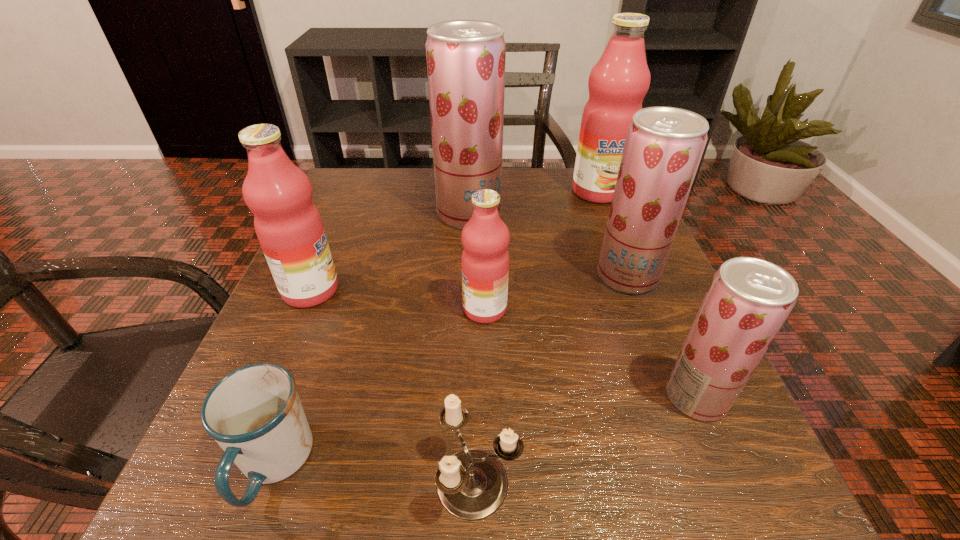
At what (x,y) coordinates should I click in order to perform the action: click on candle holder. Please return your answer as a coordinate pair (x, y). This screenshot has width=960, height=540. Looking at the image, I should click on (472, 484).

Locate an element on the screen. The height and width of the screenshot is (540, 960). mug is located at coordinates (254, 413).

Locate an element on the screen. This screenshot has width=960, height=540. free location located 0.110m on the right of the leftmost strawberry fruit juice is located at coordinates (550, 213).

At what (x,y) coordinates should I click in order to perform the action: click on free space located 0.250m on the label of the biggest pink fruit juice. Please return your answer as a coordinate pair (x, y). Looking at the image, I should click on (632, 276).

Find the location of a particular element. This screenshot has width=960, height=540. free space located on the front of the second biggest strawberry fruit juice is located at coordinates (695, 451).

Locate an element on the screen. vacant point located 0.310m on the label of the leftmost pink fruit juice is located at coordinates (510, 291).

Where is `vacant space located on the label of the second pink fruit juice from left to right`? The height and width of the screenshot is (540, 960). vacant space located on the label of the second pink fruit juice from left to right is located at coordinates (411, 309).

You are a GUI agent. You are given a task and a screenshot of the screen. Output one action in this format:
    pyautogui.click(x=<x>, y=<y>)
    Task: Click on the vacant position located on the label of the second pink fruit juice from left to right
    
    Given the screenshot: What is the action you would take?
    pyautogui.click(x=283, y=309)

Where is `free space located 0.150m on the label of the second pink fruit juice from left to right`? free space located 0.150m on the label of the second pink fruit juice from left to right is located at coordinates (376, 309).

Where is `free location located on the left of the nearest strawberry fruit juice`? The image size is (960, 540). free location located on the left of the nearest strawberry fruit juice is located at coordinates (457, 397).